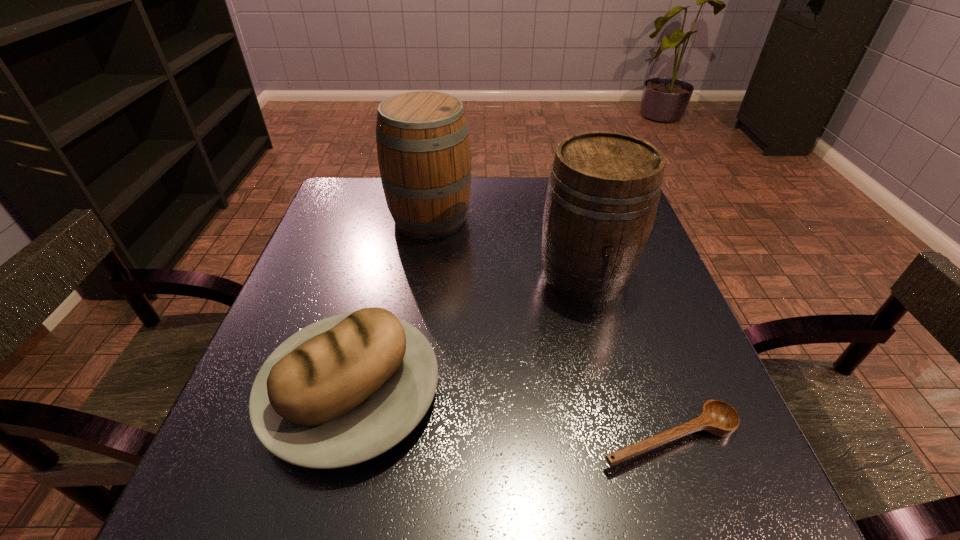
The height and width of the screenshot is (540, 960). Find the location of `the farthest object`. the farthest object is located at coordinates (423, 149).

The width and height of the screenshot is (960, 540). Identify the location of the left cider. (423, 149).

You are a GUI agent. You are given a task and a screenshot of the screen. Output one action in this format:
    pyautogui.click(x=<x>, y=<y>)
    Task: Click on the nearer cider
    
    Given the screenshot: What is the action you would take?
    pyautogui.click(x=603, y=191)

Where is `the second farthest object`? This screenshot has height=540, width=960. the second farthest object is located at coordinates (603, 191).

This screenshot has width=960, height=540. What are the coordinates of `bread` in the screenshot? It's located at (345, 389).

Locate an element on the screen. The width and height of the screenshot is (960, 540). the shortest object is located at coordinates (717, 417).

Identify the location of vacant space located 0.120m on the left of the farther cider. (344, 218).

You are a GUI agent. You are given a task and a screenshot of the screen. Output one action in this format:
    pyautogui.click(x=<x>, y=<y>)
    Task: Click on the free space located on the side of the second farthest object near the bung hole
    This screenshot has height=540, width=960.
    Given the screenshot: What is the action you would take?
    pyautogui.click(x=615, y=388)

You are a GUI agent. You are given a task and a screenshot of the screen. Output one action in this format:
    pyautogui.click(x=<x>, y=<y>)
    Task: Click on the vacant region located 0.120m on the back of the bread
    
    Given the screenshot: What is the action you would take?
    pyautogui.click(x=378, y=285)

Identify the location of vacant area situated 0.130m on the left of the wooden spoon. This screenshot has width=960, height=540. (516, 438).